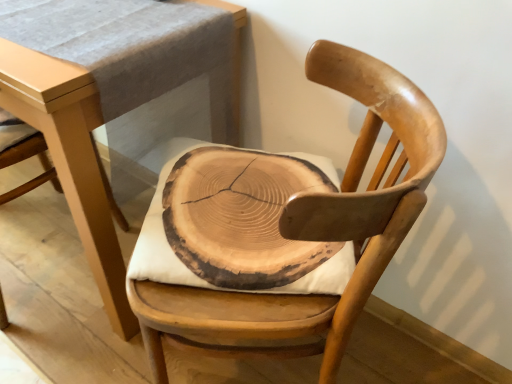
Where is `free location above wooden slice cushion at center (from a real-world perspective)`? The width and height of the screenshot is (512, 384). free location above wooden slice cushion at center (from a real-world perspective) is located at coordinates (229, 189).